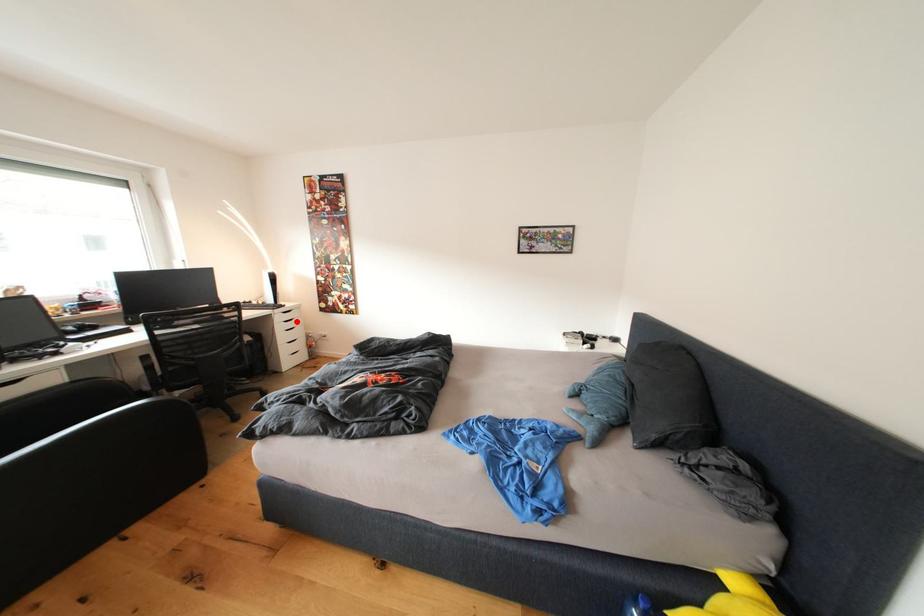
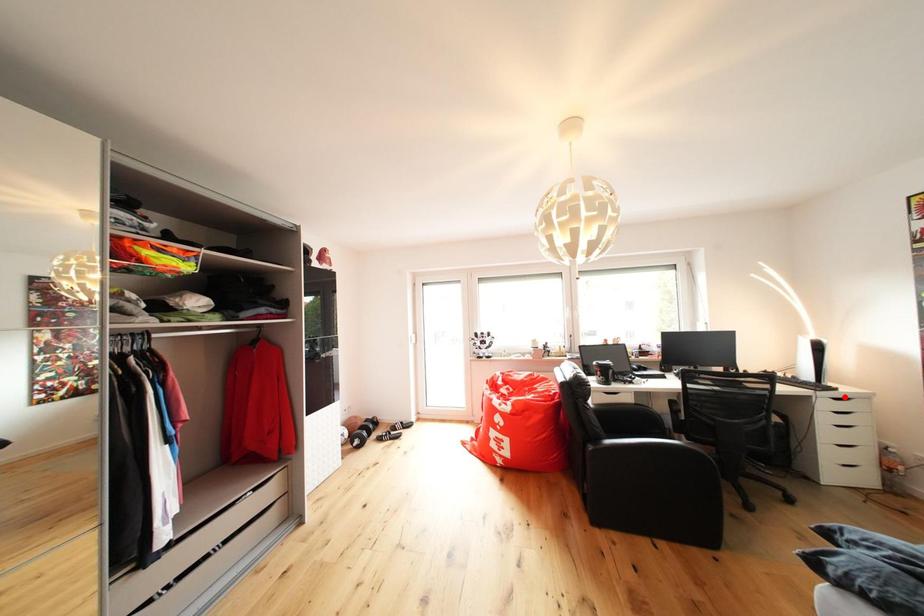
I am providing you with two images of the same scene from different viewpoints. A red point is marked on the first image and another point is marked on the second image. Is the marked point in image1 the same physical position as the marked point in image2?

No